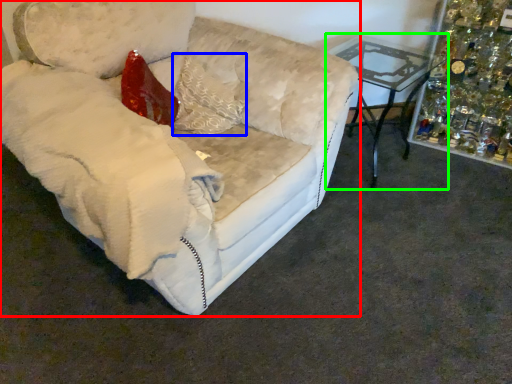
Question: Which is nearer to the studio couch (highlighted by a red box)? pillow (highlighted by a blue box) or table (highlighted by a green box).

Choices:
 (A) pillow
 (B) table

Answer: (A)